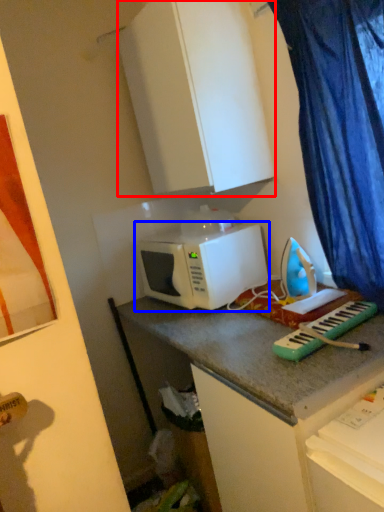
Question: Which object appears farthest to the camera in this image, cabinetry (highlighted by a red box) or microwave oven (highlighted by a blue box)?

Choices:
 (A) cabinetry
 (B) microwave oven

Answer: (B)